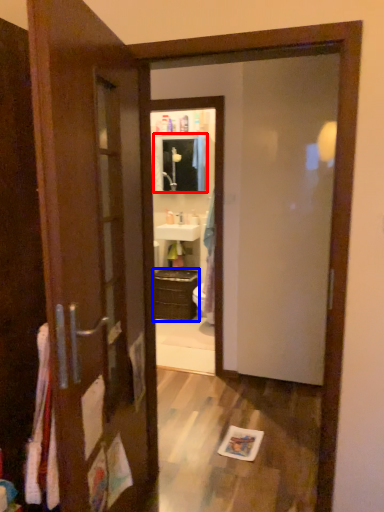
Question: Which point is closer to the camera, medicine cabinet (highlighted by a red box) or cabinetry (highlighted by a blue box)?

Choices:
 (A) medicine cabinet
 (B) cabinetry

Answer: (B)